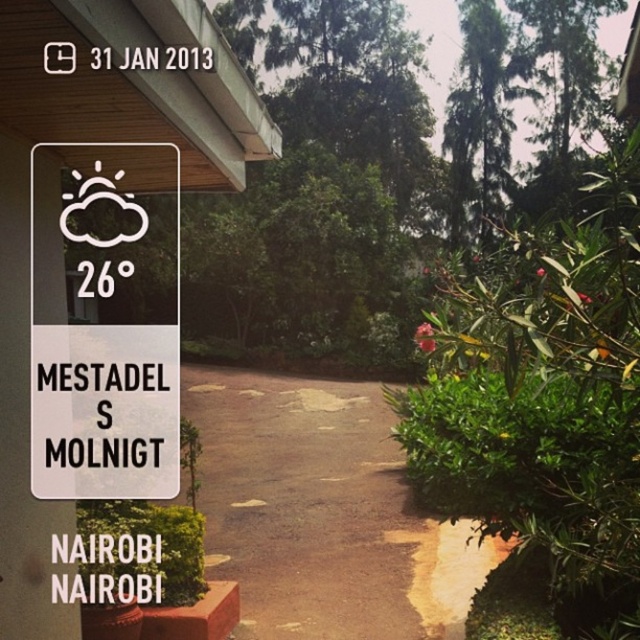
Question: Is brown asphalt path at center wider than white plastic sign at upper left?

Choices:
 (A) no
 (B) yes

Answer: (B)

Question: Which of the following is the closest to the observer?

Choices:
 (A) (150, 460)
 (B) (324, 536)

Answer: (A)

Question: Is brown asphalt path at center in front of white plastic sign at upper left?

Choices:
 (A) yes
 (B) no

Answer: (B)

Question: Is brown asphalt path at center closer to the viewer compared to white plastic sign at upper left?

Choices:
 (A) no
 (B) yes

Answer: (A)

Question: Which object appears farthest from the camera in this image?

Choices:
 (A) brown asphalt path at center
 (B) white plastic sign at upper left

Answer: (A)